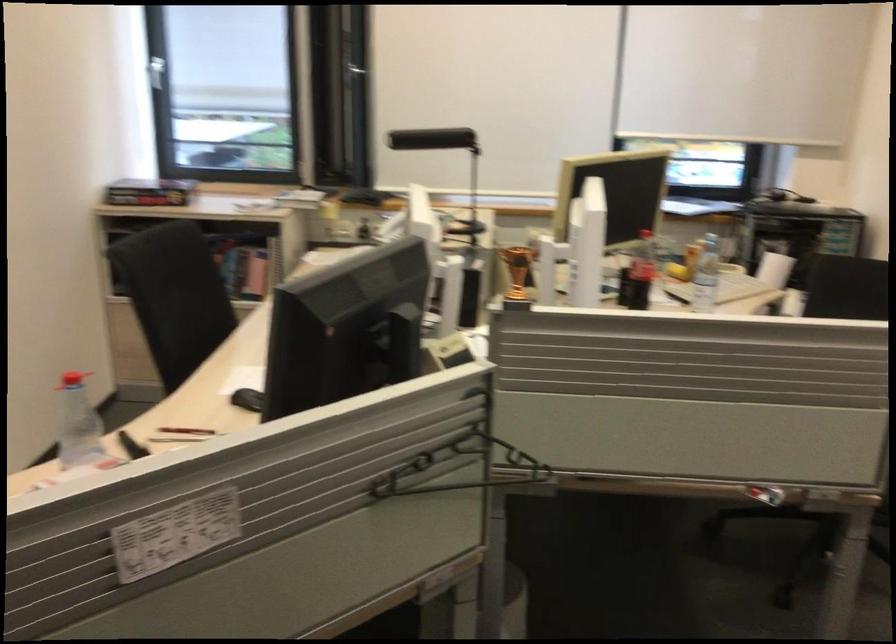
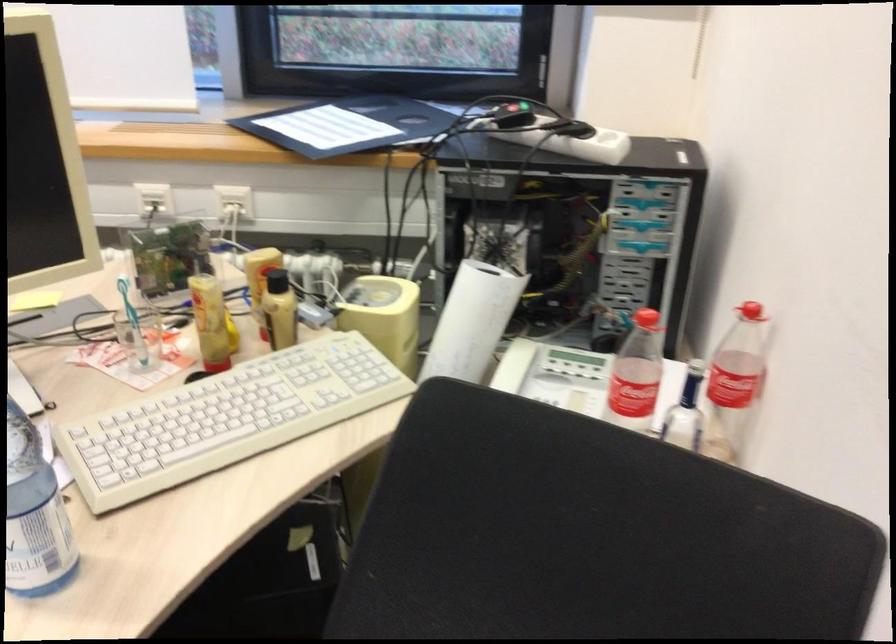
In a continuous first-person perspective shot, in which direction is the camera moving?

The cameraman moved toward right, forward.